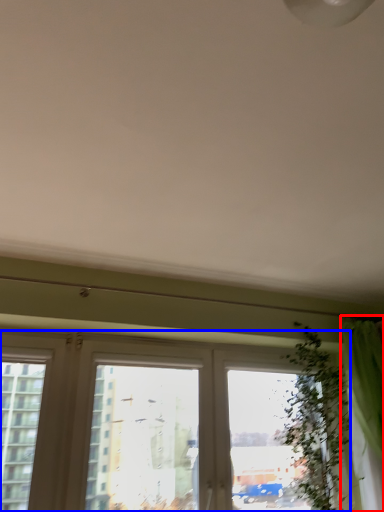
Question: Which of the following is the closest to the observer, curtain (highlighted by a red box) or window (highlighted by a blue box)?

Choices:
 (A) curtain
 (B) window

Answer: (B)